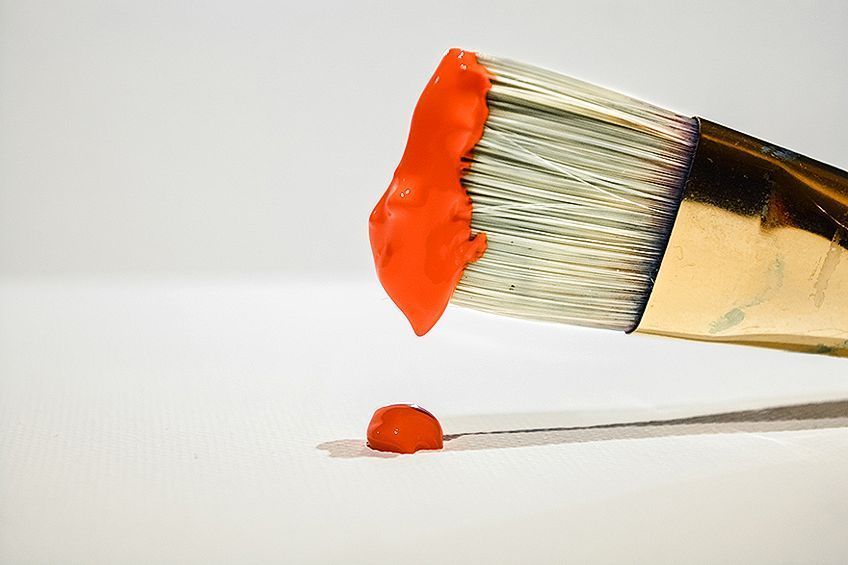
Where is `white wall`? This screenshot has width=848, height=565. white wall is located at coordinates (264, 101).